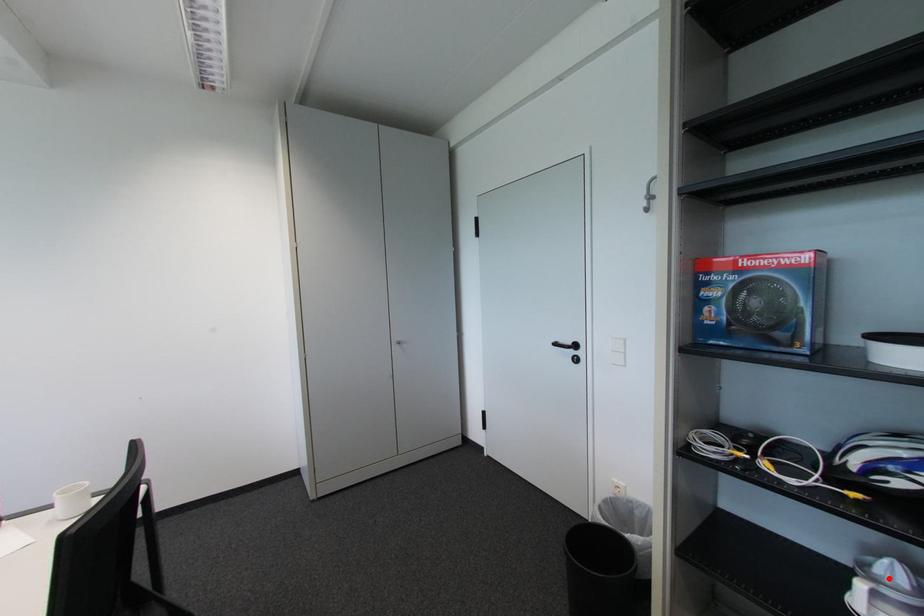
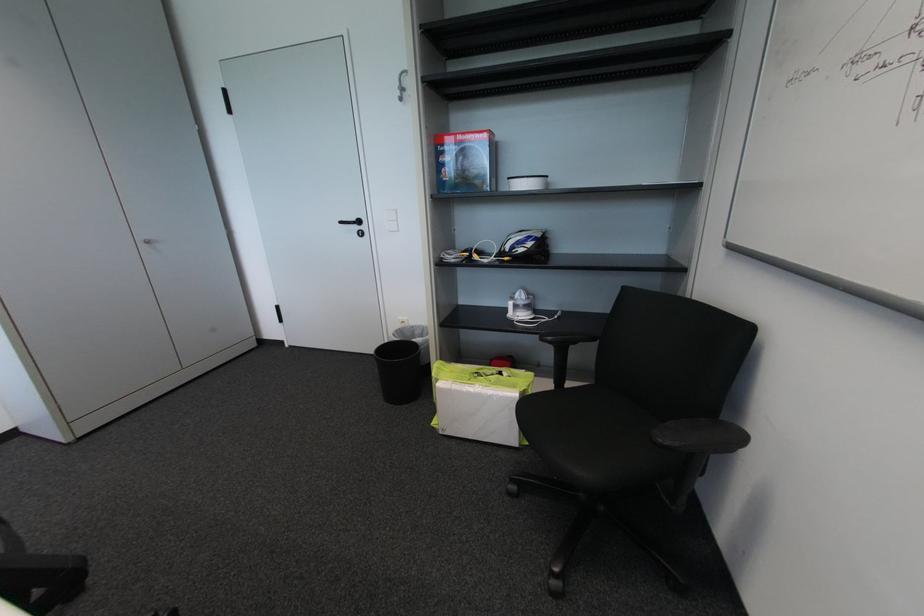
The point at the highlighted location is marked in the first image. Where is the corresponding point in the second image?

(524, 301)